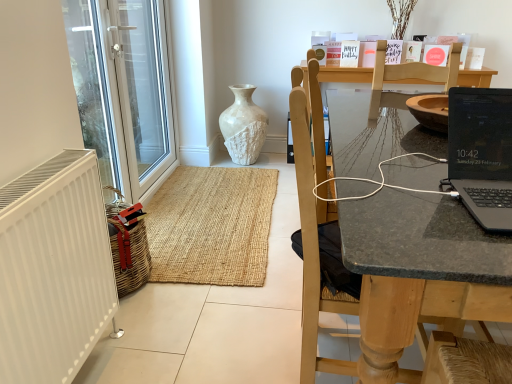
This screenshot has height=384, width=512. I want to click on free spot in front of white textured vase at center, so click(256, 175).